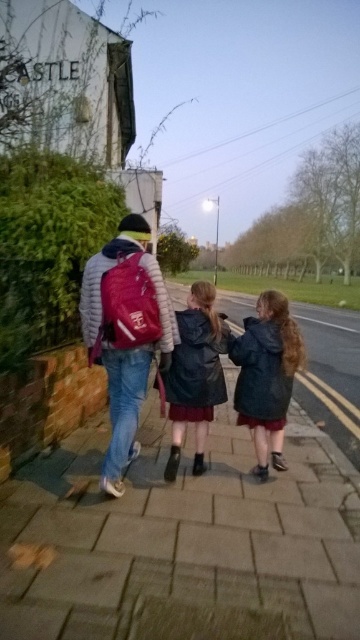
You are a photographer standing on the sidewalk and want to take a photo of the two jackets mentioned. Since you want to capture both jackets clearly in your shot, which jacket should you focus on first, the dark blue jacket at center or the leather jacket at center?

The dark blue jacket at center is located below the leather jacket at center, so you should focus on the leather jacket at center first because it is higher up and might be in the foreground, ensuring both are in focus.

In the scene shown: You are standing at the edge of the paved stone sidewalk at center and want to throw a frisbee to your friend who is standing 6 feet away from you. Can you reach your friend with one throw?

The paved stone sidewalk at center is 5.96 feet from viewer, so yes, you can reach your friend who is 6 feet away with one throw since the distance is slightly more than the sidewalk length.